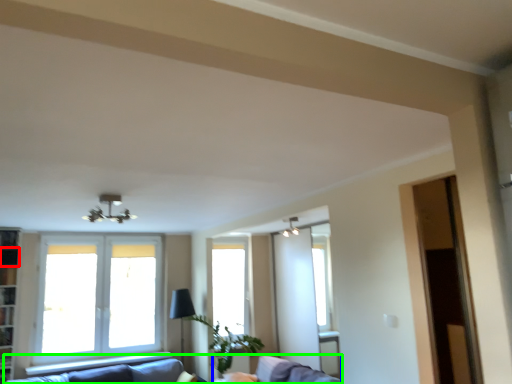
Question: Which is nearer to the shelf (highlighted by a red box)? swivel chair (highlighted by a blue box) or studio couch (highlighted by a green box).

Choices:
 (A) swivel chair
 (B) studio couch

Answer: (B)